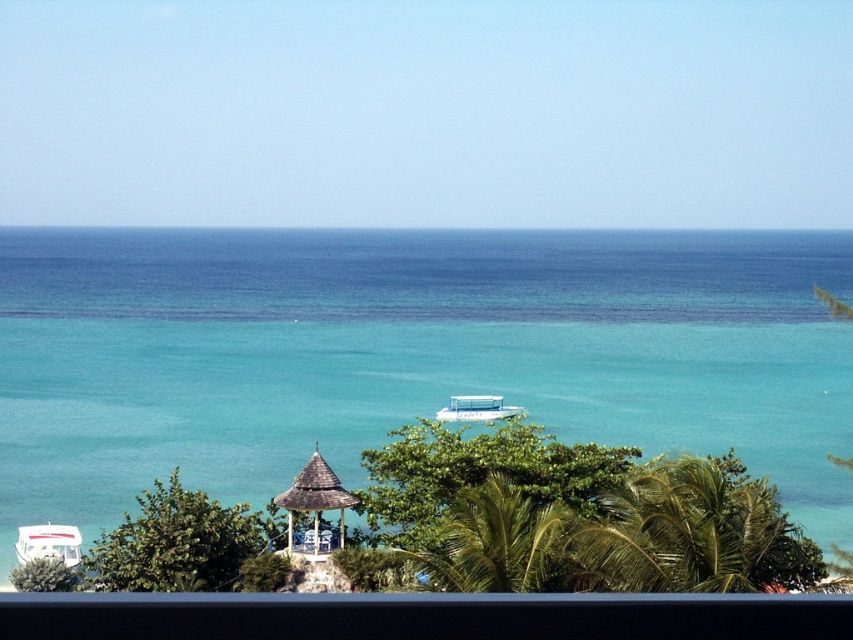
You are a visitor at the coastal scene and want to take a photo of the wooden gazebo at center and the white glossy boat at lower left. Which object should you focus on first if you want to capture both in the same frame without moving the camera?

The wooden gazebo at center is shorter than the white glossy boat at lower left. To capture both in the same frame without moving the camera, focus on the wooden gazebo at center first since it is closer to the ground and shorter, allowing the taller boat to be included in the frame as well.

You are planning to take a boat ride and see both the white glossy boat at lower left and the white plastic boat at center. Which boat would you choose if you prefer a larger vessel?

The white glossy boat at lower left is bigger than the white plastic boat at center, so you should choose the white glossy boat at lower left.

You are standing at the origin point of the coordinate system in the coastal scene. The white glossy boat at lower left is located at coordinate point 0.850, 0.059. If you want to walk directly towards the boat, in which direction should you move?

To reach the white glossy boat at lower left located at coordinate point (49, 544) from the origin, you should move towards the lower left direction since the boat is positioned at lower left in the image.